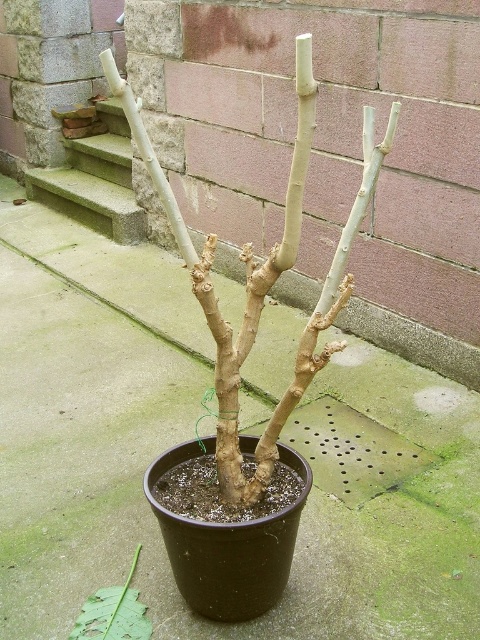
Looking at this image, you are standing 1.2 meters away from the potted plant. Can you reach the point at coordinates point [149,160] without moving your feet?

The point at coordinates point [149,160] is 1.05 meters from the viewer. Since you are standing 1.2 meters away from the potted plant, you can reach the point without moving your feet because the distance is within your reach.

You are a gardener who needs to transport the smooth beige branches at center and the green concrete stairs at upper left. Which object requires a smaller container due to its size?

The smooth beige branches at center requires a smaller container because it has a smaller size compared to the green concrete stairs at upper left.